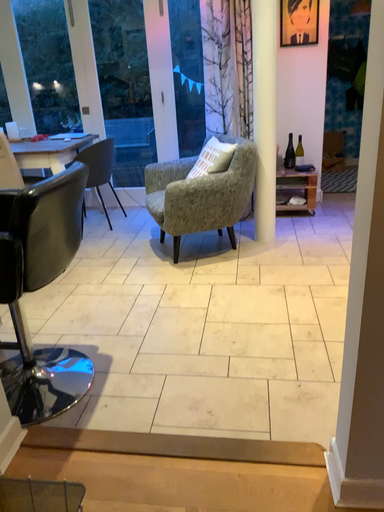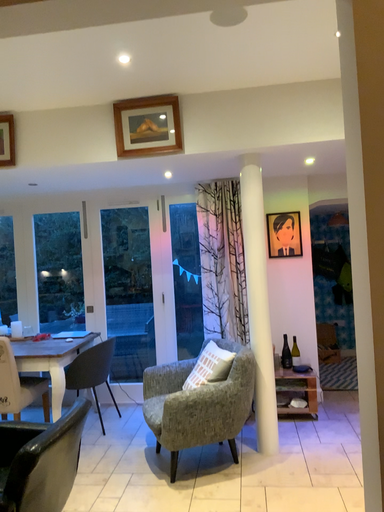
Question: How did the camera likely rotate when shooting the video?

Choices:
 (A) rotated upward
 (B) rotated downward

Answer: (A)